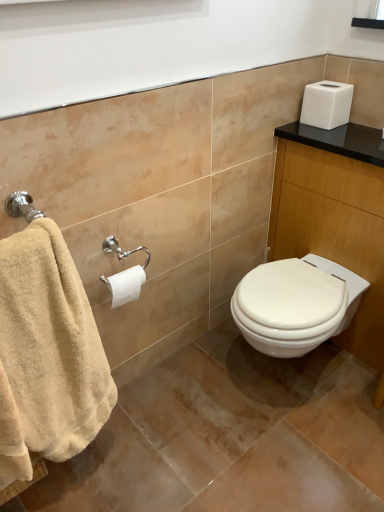
Question: Would you say white glossy vanity at upper right is to the left or to the right of white matte toilet paper at center left in the picture?

Choices:
 (A) right
 (B) left

Answer: (A)

Question: From the image's perspective, relative to white matte toilet paper at center left, is white glossy vanity at upper right above or below?

Choices:
 (A) above
 (B) below

Answer: (A)

Question: Which object is the farthest from the beige cotton towel at left?

Choices:
 (A) white matte toilet paper at center left
 (B) white glossy vanity at upper right

Answer: (B)

Question: Which object is the farthest from the white matte toilet paper at center left?

Choices:
 (A) beige cotton towel at left
 (B) white glossy vanity at upper right

Answer: (B)